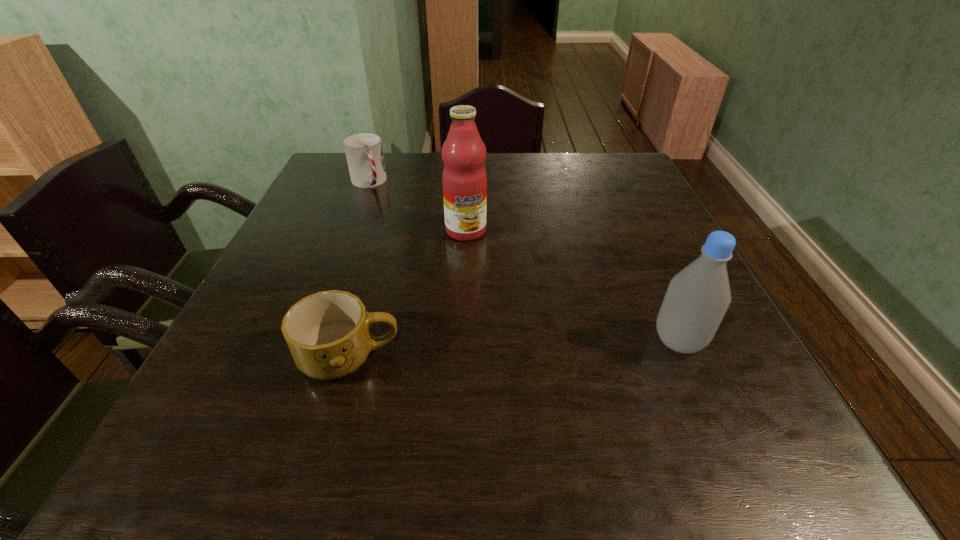
The image size is (960, 540). I want to click on free space on the desktop that is between the mug and the rightmost object and is positioned on the side of the cup where the handle is located, so click(x=473, y=351).

At what (x,y) coordinates should I click in order to perform the action: click on vacant space on the desktop that is between the mug and the bottle and is positioned on the label of the fruit juice. Please return your answer as a coordinate pair (x, y). Looking at the image, I should click on (496, 350).